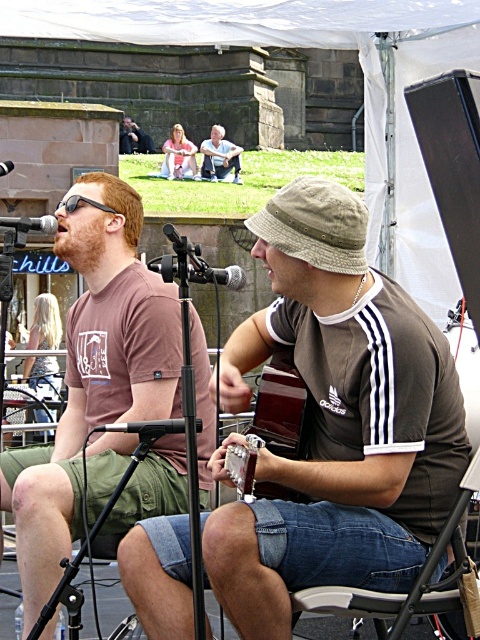
Does black matte microphone at center come in front of light blue jeans at center?

That is True.

Is point (175, 266) closer to camera compared to point (205, 144)?

Yes, point (175, 266) is in front of point (205, 144).

Identify the location of black matte microphone at center. (196, 269).

From the picture: Can you confirm if denim fabric folding chair at lower center is positioned to the right of black matte microphone at center?

Yes, denim fabric folding chair at lower center is to the right of black matte microphone at center.

Between point (479, 460) and point (196, 253), which one is positioned in front?

Point (479, 460) is more forward.

This screenshot has height=640, width=480. Find the location of `denim fabric folding chair at lower center`. denim fabric folding chair at lower center is located at coordinates (395, 593).

Which of these two, denim fabric folding chair at lower center or smooth leather jacket at upper center, stands taller?

With more height is denim fabric folding chair at lower center.

What do you see at coordinates (395, 593) in the screenshot?
I see `denim fabric folding chair at lower center` at bounding box center [395, 593].

This screenshot has width=480, height=640. In order to click on denim fabric folding chair at lower center in this screenshot , I will do `click(395, 593)`.